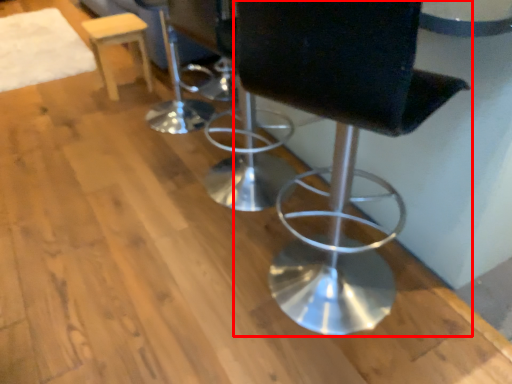
Question: Considering the relative positions of chair (annotated by the red box) and stool in the image provided, where is chair (annotated by the red box) located with respect to the staircase?

Choices:
 (A) left
 (B) right

Answer: (B)